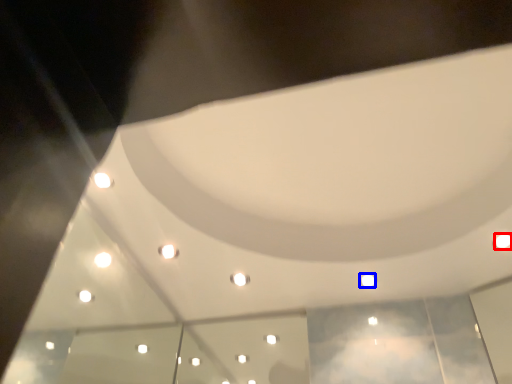
Question: Which point is closer to the camera, light (highlighted by a red box) or light (highlighted by a blue box)?

Choices:
 (A) light
 (B) light

Answer: (A)